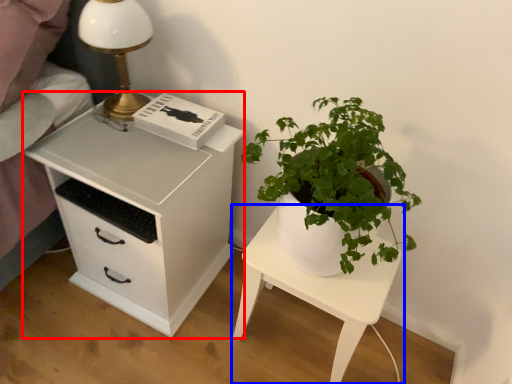
Question: Among these objects, which one is nearest to the camera, chest of drawers (highlighted by a red box) or nightstand (highlighted by a blue box)?

Choices:
 (A) chest of drawers
 (B) nightstand

Answer: (A)